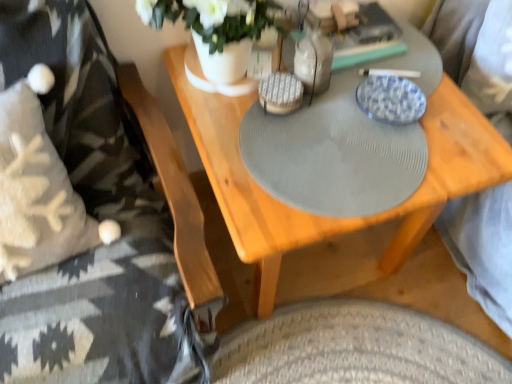
Question: In the image, is wooden table at center positioned in front of or behind clear glass bottle at center?

Choices:
 (A) behind
 (B) front

Answer: (B)

Question: Based on their sizes in the image, would you say wooden table at center is bigger or smaller than clear glass bottle at center?

Choices:
 (A) big
 (B) small

Answer: (A)

Question: Estimate the real-world distances between objects in this image. Which object is closer to the clear glass bottle at center?

Choices:
 (A) wooden table at center
 (B) blue glazed plate at upper center
 (C) knitted wool blanket at left
 (D) white matte vase at upper center

Answer: (B)

Question: Which is nearer to the white matte vase at upper center?

Choices:
 (A) wooden table at center
 (B) knitted wool blanket at left
 (C) clear glass bottle at center
 (D) blue glazed plate at upper center

Answer: (C)